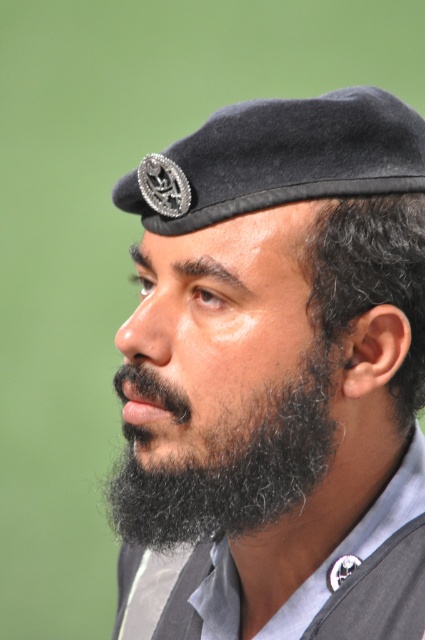
You are an artist trying to sketch the image. You need to place the black felt beret at center in your drawing. According to the image, what are the coordinates where you should position it?

The black felt beret at center should be positioned at coordinates 0.586 on the x axis and 0.649 on the y axis.

In the scene shown: You are an artist trying to sketch the scene. You notice two black felt berets in the image. Which one is closer to you, the black felt beret at center or the black felt beret at upper center?

The black felt beret at center is closer to you because the black felt beret at upper center is behind it.